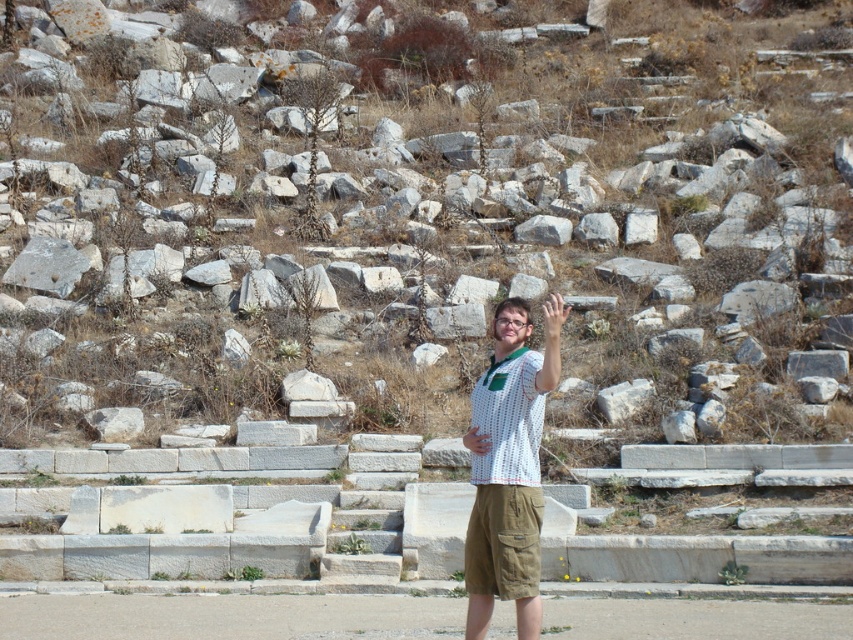
Which of these two, white stone steps at center or white dotted shirt at center, stands taller?

Standing taller between the two is white stone steps at center.

Based on the photo, can you confirm if white stone steps at center is thinner than white dotted shirt at center?

Incorrect, white stone steps at center's width is not less than white dotted shirt at center's.

Who is more distant from viewer, (225, 372) or (514, 410)?

The point (225, 372) is behind.

This screenshot has height=640, width=853. Identify the location of white stone steps at center. (433, 220).

Does white dotted shirt at center appear on the right side of khaki cotton shorts at center?

Indeed, white dotted shirt at center is positioned on the right side of khaki cotton shorts at center.

Is white dotted shirt at center wider than khaki cotton shorts at center?

Incorrect, white dotted shirt at center's width does not surpass khaki cotton shorts at center's.

Does point (508, 342) come in front of point (471, 561)?

No, it is not.

Where is `white dotted shirt at center`? white dotted shirt at center is located at coordinates (509, 467).

Who is lower down, white stone steps at center or khaki cotton shorts at center?

khaki cotton shorts at center is lower down.

Does point (373, 403) come behind point (483, 493)?

Yes, point (373, 403) is behind point (483, 493).

Does point (776, 394) come farther from viewer compared to point (474, 560)?

Yes.

The height and width of the screenshot is (640, 853). I want to click on white stone steps at center, so click(433, 220).